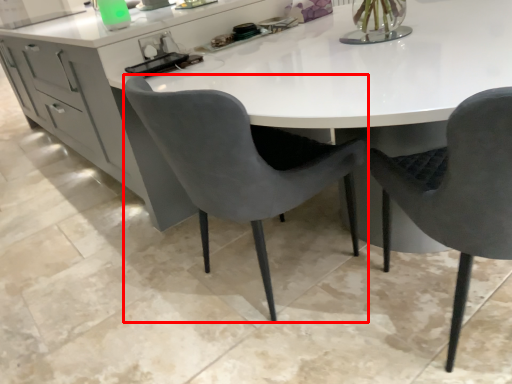
Question: In this image, where is chair (annotated by the red box) located relative to chair?

Choices:
 (A) right
 (B) left

Answer: (B)